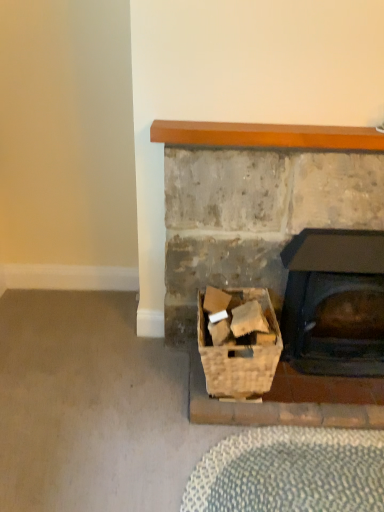
Question: Is black matte wood burning stove at center right smaller than woven wood basket at lower center?

Choices:
 (A) no
 (B) yes

Answer: (A)

Question: Can you confirm if black matte wood burning stove at center right is shorter than woven wood basket at lower center?

Choices:
 (A) yes
 (B) no

Answer: (B)

Question: From the image's perspective, would you say black matte wood burning stove at center right is shown under woven wood basket at lower center?

Choices:
 (A) yes
 (B) no

Answer: (B)

Question: Is black matte wood burning stove at center right oriented towards woven wood basket at lower center?

Choices:
 (A) yes
 (B) no

Answer: (B)

Question: Is black matte wood burning stove at center right wider than woven wood basket at lower center?

Choices:
 (A) no
 (B) yes

Answer: (A)

Question: Considering the positions of point (342, 320) and point (380, 175), is point (342, 320) closer or farther from the camera than point (380, 175)?

Choices:
 (A) farther
 (B) closer

Answer: (A)

Question: Considering the positions of black matte wood burning stove at center right and rustic stone fireplace at lower right in the image, is black matte wood burning stove at center right taller or shorter than rustic stone fireplace at lower right?

Choices:
 (A) short
 (B) tall

Answer: (A)

Question: From a real-world perspective, relative to rustic stone fireplace at lower right, is black matte wood burning stove at center right vertically above or below?

Choices:
 (A) below
 (B) above

Answer: (A)

Question: Looking at their shapes, would you say black matte wood burning stove at center right is wider or thinner than rustic stone fireplace at lower right?

Choices:
 (A) wide
 (B) thin

Answer: (A)

Question: From the image's perspective, relative to black matte wood burning stove at center right, is wooden mantel at upper center above or below?

Choices:
 (A) below
 (B) above

Answer: (B)

Question: Is wooden mantel at upper center wider or thinner than black matte wood burning stove at center right?

Choices:
 (A) thin
 (B) wide

Answer: (A)

Question: Relative to black matte wood burning stove at center right, is wooden mantel at upper center in front or behind?

Choices:
 (A) behind
 (B) front

Answer: (B)

Question: From their relative heights in the image, would you say wooden mantel at upper center is taller or shorter than black matte wood burning stove at center right?

Choices:
 (A) tall
 (B) short

Answer: (B)

Question: From a real-world perspective, relative to rustic stone fireplace at lower right, is woven wood basket at lower center vertically above or below?

Choices:
 (A) below
 (B) above

Answer: (A)

Question: From the image's perspective, is woven wood basket at lower center located above or below rustic stone fireplace at lower right?

Choices:
 (A) above
 (B) below

Answer: (B)